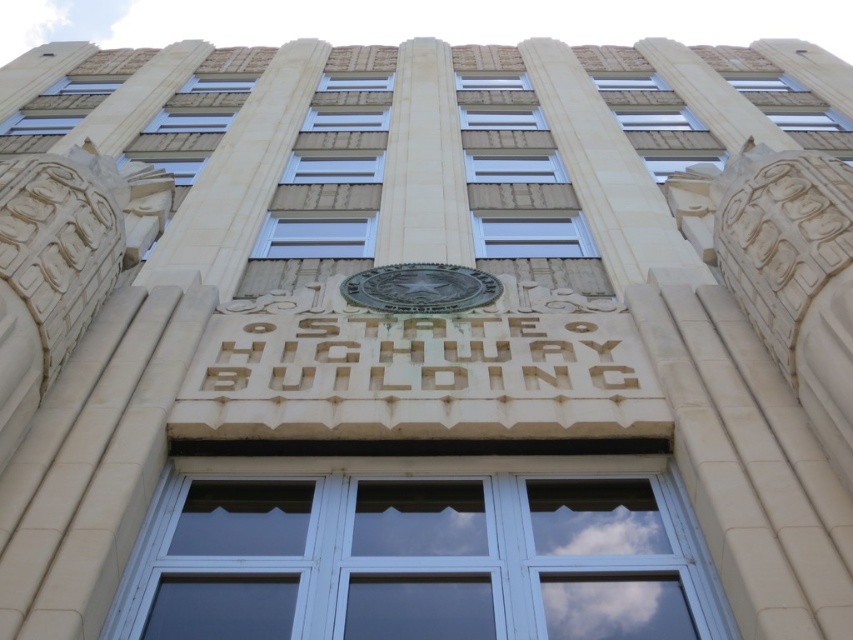
Does white carved stone at center have a greater width compared to bronze textured seal at center?

Yes, white carved stone at center is wider than bronze textured seal at center.

What do you see at coordinates (422, 355) in the screenshot?
I see `white carved stone at center` at bounding box center [422, 355].

Which is in front, point (283, 362) or point (367, 282)?

Positioned in front is point (283, 362).

Identify the location of white carved stone at center. (422, 355).